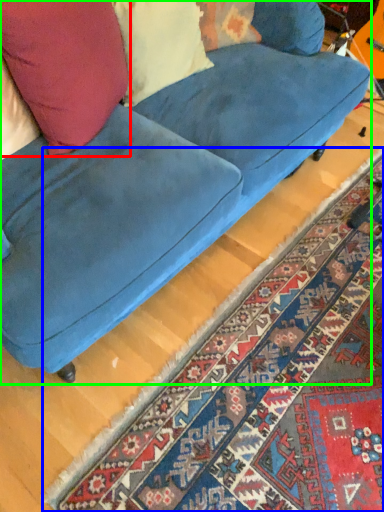
Question: Which is nearer to the throw pillow (highlighted by a red box)? mat (highlighted by a blue box) or studio couch (highlighted by a green box).

Choices:
 (A) mat
 (B) studio couch

Answer: (B)